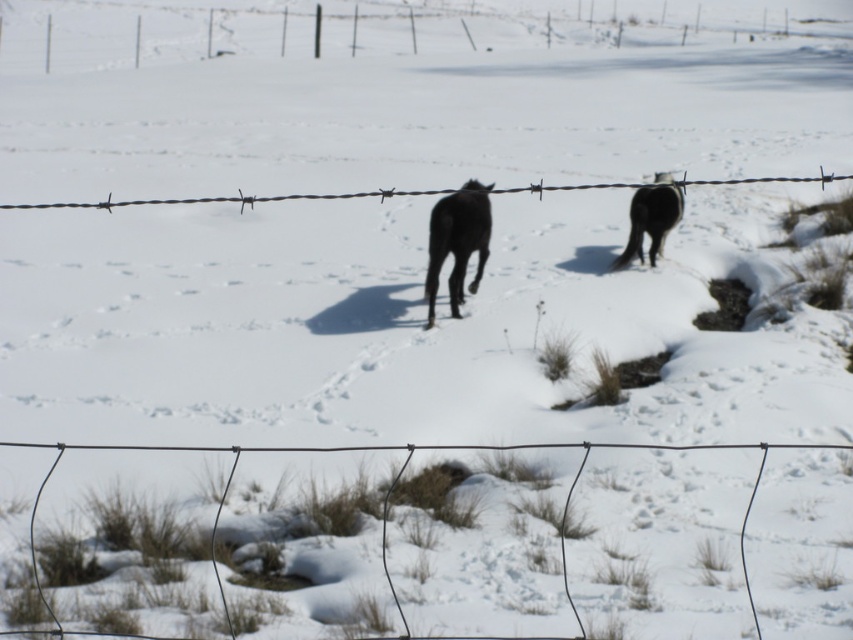
Question: Which is farther from the black glossy horse at center?

Choices:
 (A) wire mesh at center
 (B) barbed wire at upper center

Answer: (B)

Question: Can you confirm if wire mesh at center is wider than black glossy horse at center?

Choices:
 (A) no
 (B) yes

Answer: (B)

Question: Which object is farther from the camera taking this photo?

Choices:
 (A) barbed wire at center
 (B) black glossy horse at right
 (C) black glossy horse at center
 (D) barbed wire at upper center

Answer: (D)

Question: Is barbed wire at center positioned at the back of black glossy horse at right?

Choices:
 (A) yes
 (B) no

Answer: (B)

Question: Does black glossy horse at center have a lesser width compared to barbed wire at center?

Choices:
 (A) yes
 (B) no

Answer: (A)

Question: Among these objects, which one is nearest to the camera?

Choices:
 (A) barbed wire at center
 (B) black glossy horse at center
 (C) wire mesh at center
 (D) black glossy horse at right

Answer: (A)